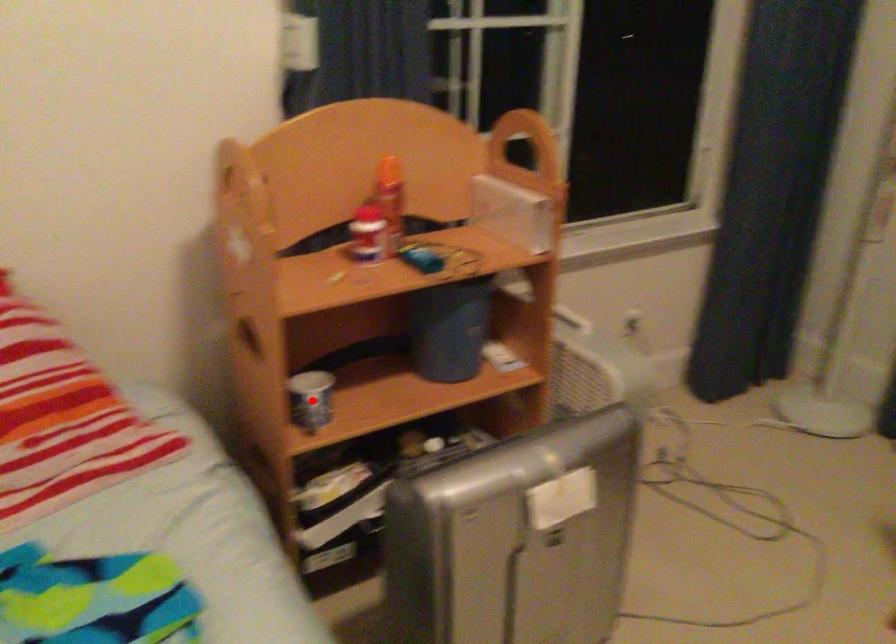
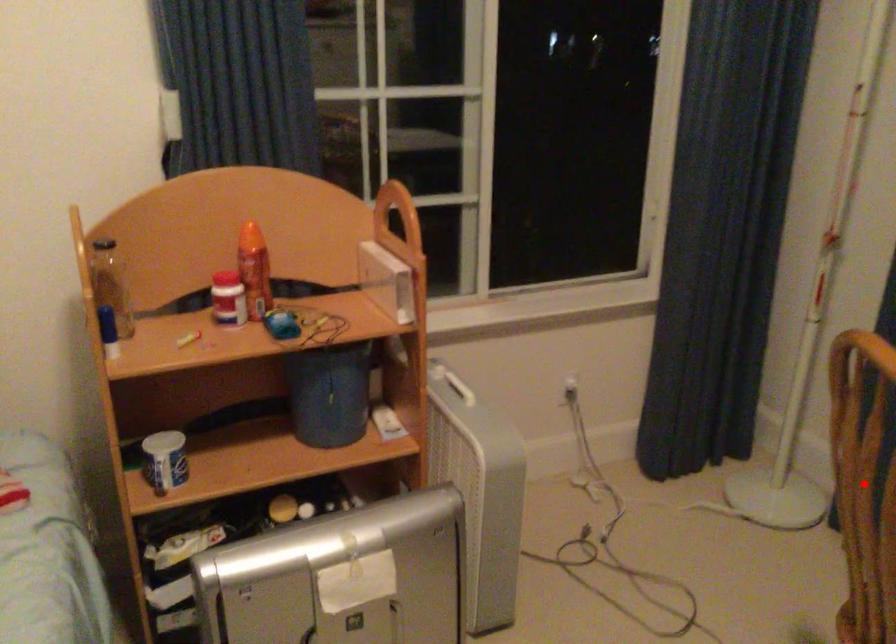
I am providing you with two images of the same scene from different viewpoints. A red point is marked on the first image and another point is marked on the second image. Does the point marked in image1 correspond to the same location as the one in image2?

No